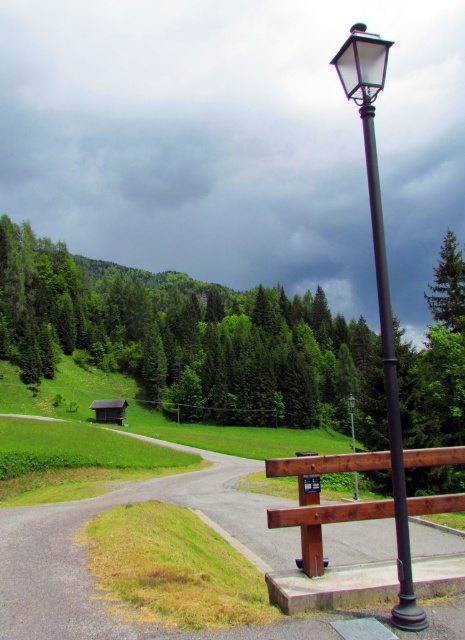
Is asphalt road at center to the right of black metal pole at center from the viewer's perspective?

In fact, asphalt road at center is to the left of black metal pole at center.

Is asphalt road at center taller than black metal pole at center?

Incorrect, asphalt road at center's height is not larger of black metal pole at center's.

Identify the location of asphalt road at center. The image size is (465, 640). click(x=86, y=561).

Is black metal pole at center above brown wooden hut at lower left?

Correct, black metal pole at center is located above brown wooden hut at lower left.

Which of these two, black metal pole at center or brown wooden hut at lower left, stands shorter?

With less height is brown wooden hut at lower left.

Does point (425, 618) lie behind point (106, 420)?

No.

Where is `black metal pole at center`? black metal pole at center is located at coordinates (390, 387).

Is brown wooden bench at center smaller than matte black street light at upper right?

Yes, brown wooden bench at center is smaller than matte black street light at upper right.

Between brown wooden bench at center and matte black street light at upper right, which one is positioned higher?

brown wooden bench at center is higher up.

Find the location of `brown wooden bench at center`. brown wooden bench at center is located at coordinates (321, 540).